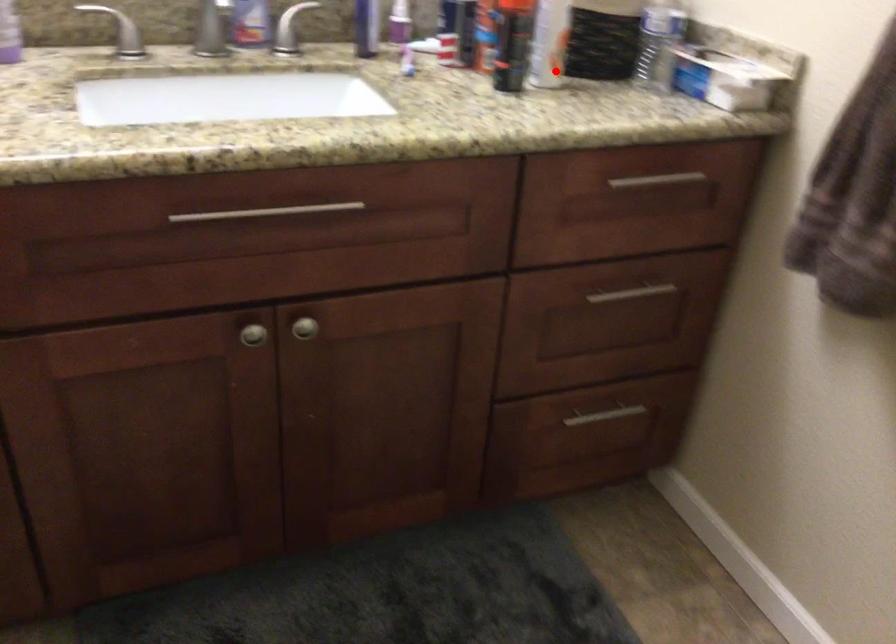
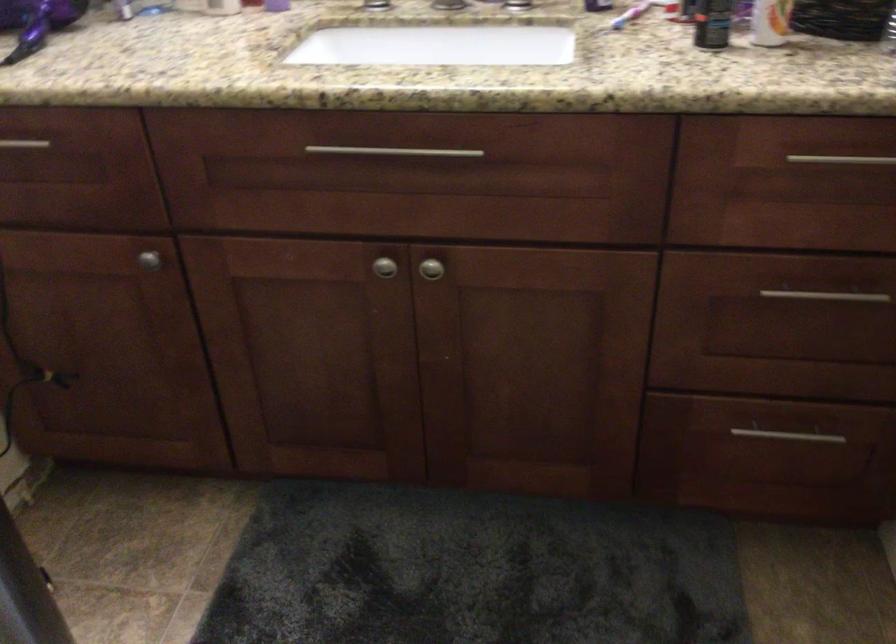
In the second image, find the point that corresponds to the highlighted location in the first image.

(770, 22)